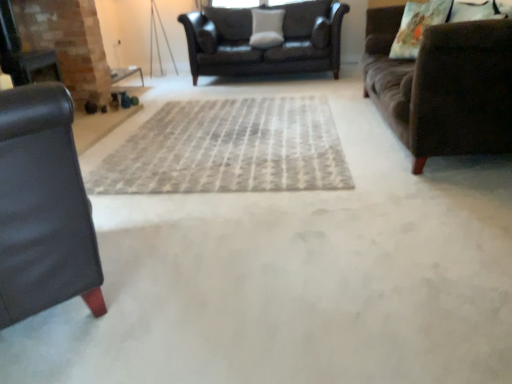
This screenshot has width=512, height=384. What do you see at coordinates (266, 28) in the screenshot? I see `white fabric pillow at center, which ranks as the 1th pillow in top-to-bottom order` at bounding box center [266, 28].

Identify the location of printed fabric pillow at upper right, marked as the 2th pillow in a back-to-front arrangement. (417, 26).

Locate an element on the screen. dark brown leather couch at center, which is counted as the third studio couch, starting from the front is located at coordinates (263, 48).

Where is `black leather couch at left, the 3th studio couch when ordered from back to front`? This screenshot has width=512, height=384. black leather couch at left, the 3th studio couch when ordered from back to front is located at coordinates (42, 207).

You are a GUI agent. You are given a task and a screenshot of the screen. Output one action in this format:
    pyautogui.click(x=<x>, y=<y>)
    Task: Click on the white fabric pillow at center, the second pillow from the right
    
    Given the screenshot: What is the action you would take?
    pyautogui.click(x=266, y=28)

From a real-world perspective, which object rests below the other?

dark brown leather couch at center, the 1th studio couch from the back, from a real-world perspective.

Considering the positions of point (196, 55) and point (60, 1), is point (196, 55) closer or farther from the camera than point (60, 1)?

Point (196, 55) appears to be farther away from the viewer than point (60, 1).

Is dark brown leather couch at center, the 1th studio couch from the back, facing away from black leather fireplace at left?

No, black leather fireplace at left is not at the back of dark brown leather couch at center, the 1th studio couch from the back.

Where is `studio couch above the black leather fireplace at left (from the image's perspective)`? The height and width of the screenshot is (384, 512). studio couch above the black leather fireplace at left (from the image's perspective) is located at coordinates (263, 48).

Is black leather fireplace at left oriented towards dark brown leather couch at center, which is counted as the third studio couch, starting from the front?

No, black leather fireplace at left is not turned towards dark brown leather couch at center, which is counted as the third studio couch, starting from the front.

Looking at the image, does black leather fireplace at left seem bigger or smaller compared to dark brown leather couch at center, the 1th studio couch from the back?

Clearly, black leather fireplace at left is smaller in size than dark brown leather couch at center, the 1th studio couch from the back.

Does point (28, 9) lie in front of point (284, 66)?

That is True.

Is black leather fireplace at left outside of dark brown leather couch at center, the 1th studio couch from the back?

Yes, black leather fireplace at left is located beyond the bounds of dark brown leather couch at center, the 1th studio couch from the back.

Does black leather couch at left, the 3th studio couch when ordered from back to front, touch white fabric pillow at center, which ranks as the 1th pillow in top-to-bottom order?

No, black leather couch at left, the 3th studio couch when ordered from back to front, is not making contact with white fabric pillow at center, which ranks as the 1th pillow in top-to-bottom order.

Is black leather couch at left, the 3th studio couch when ordered from back to front, facing towards white fabric pillow at center, which ranks as the 1th pillow in top-to-bottom order?

No, black leather couch at left, the 3th studio couch when ordered from back to front, is not turned towards white fabric pillow at center, which ranks as the 1th pillow in top-to-bottom order.

Is black leather couch at left, the 3th studio couch when ordered from back to front, at the right side of white fabric pillow at center, positioned as the second pillow in bottom-to-top order?

No.

From a real-world perspective, is black leather couch at left, which ranks as the first studio couch in front-to-back order, positioned above or below white fabric pillow at center, the second pillow from the right?

black leather couch at left, which ranks as the first studio couch in front-to-back order, is situated lower than white fabric pillow at center, the second pillow from the right, in the real world.

Between white fabric pillow at center, the second pillow from the right, and dark brown leather couch at center, which is counted as the third studio couch, starting from the front, which one has larger width?

dark brown leather couch at center, which is counted as the third studio couch, starting from the front, is wider.

From a real-world perspective, relative to dark brown leather couch at center, which is counted as the third studio couch, starting from the front, is white fabric pillow at center, positioned as the second pillow in bottom-to-top order, vertically above or below?

Clearly, from a real-world perspective, white fabric pillow at center, positioned as the second pillow in bottom-to-top order, is above dark brown leather couch at center, which is counted as the third studio couch, starting from the front.

Is white fabric pillow at center, marked as the 1th pillow in a left-to-right arrangement, aimed at dark brown leather couch at center, which is counted as the third studio couch, starting from the front?

Yes, white fabric pillow at center, marked as the 1th pillow in a left-to-right arrangement, is turned towards dark brown leather couch at center, which is counted as the third studio couch, starting from the front.

In terms of width, does black leather couch at left, which ranks as the first studio couch in front-to-back order, look wider or thinner when compared to gray woven rug at center?

Considering their sizes, black leather couch at left, which ranks as the first studio couch in front-to-back order, looks slimmer than gray woven rug at center.

From the image's perspective, which is below, black leather couch at left, which ranks as the first studio couch in front-to-back order, or gray woven rug at center?

black leather couch at left, which ranks as the first studio couch in front-to-back order.

Is black leather couch at left, which ranks as the first studio couch in front-to-back order, at the left side of gray woven rug at center?

Yes, black leather couch at left, which ranks as the first studio couch in front-to-back order, is to the left of gray woven rug at center.

Looking at this image, which object is positioned more to the left, brown fabric couch at right, which is the 2th studio couch in front-to-back order, or printed fabric pillow at upper right, the 1th pillow in the front-to-back sequence?

printed fabric pillow at upper right, the 1th pillow in the front-to-back sequence, is more to the left.

From their relative heights in the image, would you say brown fabric couch at right, which is the 2th studio couch in front-to-back order, is taller or shorter than printed fabric pillow at upper right, the 1th pillow in the front-to-back sequence?

Considering their sizes, brown fabric couch at right, which is the 2th studio couch in front-to-back order, has more height than printed fabric pillow at upper right, the 1th pillow in the front-to-back sequence.

Does brown fabric couch at right, which is the 2th studio couch in front-to-back order, have a larger size compared to printed fabric pillow at upper right, the 1th pillow viewed from the right?

Yes, brown fabric couch at right, which is the 2th studio couch in front-to-back order, is bigger than printed fabric pillow at upper right, the 1th pillow viewed from the right.

Considering the relative positions of gray woven rug at center and dark brown leather couch at center, the 1th studio couch from the back, in the image provided, is gray woven rug at center to the left of dark brown leather couch at center, the 1th studio couch from the back, from the viewer's perspective?

Yes.

Could you tell me if gray woven rug at center is facing dark brown leather couch at center, the 1th studio couch from the back?

No, gray woven rug at center is not aimed at dark brown leather couch at center, the 1th studio couch from the back.

Is gray woven rug at center not inside dark brown leather couch at center, which is counted as the third studio couch, starting from the front?

Yes.

In the scene shown: What's the angular difference between gray woven rug at center and dark brown leather couch at center, which is counted as the third studio couch, starting from the front,'s facing directions?

2.32e-05 degrees.

Identify the location of fireplace that is on the left side of dark brown leather couch at center, which is counted as the third studio couch, starting from the front. This screenshot has height=384, width=512. (68, 43).

The width and height of the screenshot is (512, 384). I want to click on studio couch behind the black leather fireplace at left, so click(263, 48).

Considering their positions, is white fabric pillow at center, the second pillow from the right, positioned further to printed fabric pillow at upper right, the 1th pillow viewed from the right, than gray woven rug at center?

The object further to printed fabric pillow at upper right, the 1th pillow viewed from the right, is white fabric pillow at center, the second pillow from the right.

Which object lies further to the anchor point black leather couch at left, which ranks as the first studio couch in front-to-back order, black leather fireplace at left or brown fabric couch at right, the 2th studio couch in the back-to-front sequence?

Among the two, black leather fireplace at left is located further to black leather couch at left, which ranks as the first studio couch in front-to-back order.

From the picture: When comparing their distances from white fabric pillow at center, the second pillow from the right, does dark brown leather couch at center, the 1th studio couch from the back, or brown fabric couch at right, which is the 2th studio couch in front-to-back order, seem further?

The object further to white fabric pillow at center, the second pillow from the right, is brown fabric couch at right, which is the 2th studio couch in front-to-back order.

Which object lies nearer to the anchor point printed fabric pillow at upper right, marked as the 2th pillow in a back-to-front arrangement, black leather fireplace at left or white fabric pillow at center, marked as the 1th pillow in a left-to-right arrangement?

Among the two, white fabric pillow at center, marked as the 1th pillow in a left-to-right arrangement, is located nearer to printed fabric pillow at upper right, marked as the 2th pillow in a back-to-front arrangement.

Which object lies further to the anchor point white fabric pillow at center, positioned as the second pillow in bottom-to-top order, dark brown leather couch at center, the 1th studio couch from the back, or black leather couch at left, the 3th studio couch when ordered from back to front?

black leather couch at left, the 3th studio couch when ordered from back to front, is further to white fabric pillow at center, positioned as the second pillow in bottom-to-top order.

Estimate the real-world distances between objects in this image. Which object is further from gray woven rug at center, black leather fireplace at left or dark brown leather couch at center, which is counted as the third studio couch, starting from the front?

dark brown leather couch at center, which is counted as the third studio couch, starting from the front, lies further to gray woven rug at center than the other object.

Which object lies nearer to the anchor point gray woven rug at center, white fabric pillow at center, the 2th pillow viewed from the front, or printed fabric pillow at upper right, the 1th pillow viewed from the right?

printed fabric pillow at upper right, the 1th pillow viewed from the right, is positioned closer to the anchor gray woven rug at center.

Based on their spatial positions, is black leather fireplace at left or white fabric pillow at center, the second pillow from the right, closer to gray woven rug at center?

black leather fireplace at left is closer to gray woven rug at center.

Locate an element on the screen. The width and height of the screenshot is (512, 384). pillow between brown fabric couch at right, which is the 2th studio couch in front-to-back order, and dark brown leather couch at center, the 1th studio couch from the back, from front to back is located at coordinates (417, 26).

Where is `pillow between brown fabric couch at right, which is the 2th studio couch in front-to-back order, and white fabric pillow at center, marked as the 1th pillow in a left-to-right arrangement, from front to back`? The image size is (512, 384). pillow between brown fabric couch at right, which is the 2th studio couch in front-to-back order, and white fabric pillow at center, marked as the 1th pillow in a left-to-right arrangement, from front to back is located at coordinates (417, 26).

Locate an element on the screen. This screenshot has width=512, height=384. pillow between gray woven rug at center and white fabric pillow at center, marked as the 1th pillow in a left-to-right arrangement, along the z-axis is located at coordinates (417, 26).

Identify the location of doormat situated between black leather fireplace at left and brown fabric couch at right, the 2th studio couch in the back-to-front sequence, from left to right. [228, 149].